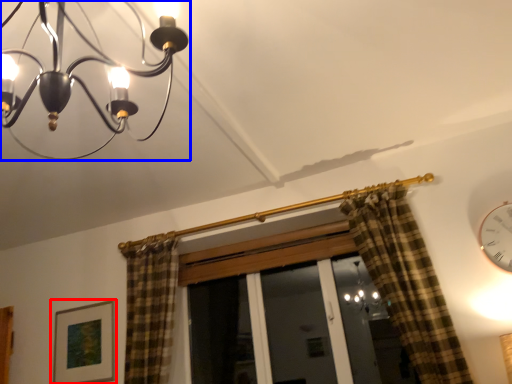
Question: Which point is closer to the camera, picture frame (highlighted by a red box) or lamp (highlighted by a blue box)?

Choices:
 (A) picture frame
 (B) lamp

Answer: (B)